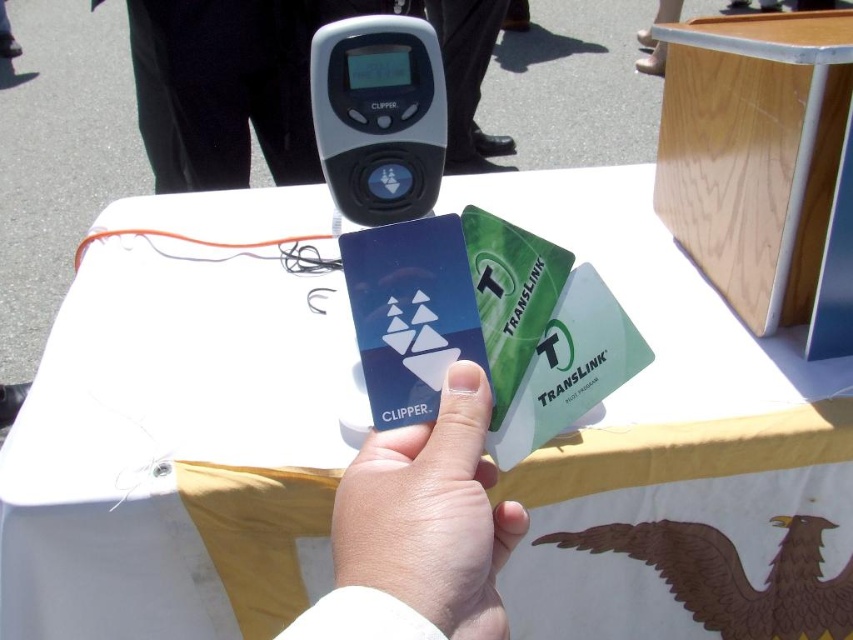
Question: Which of the following is the closest to the observer?

Choices:
 (A) white plastic table at center
 (B) white matte hand at center
 (C) brown matte/eagle at lower right
 (D) black plastic device at upper center

Answer: (B)

Question: Does white plastic table at center appear on the right side of blue plastic card at center?

Choices:
 (A) no
 (B) yes

Answer: (B)

Question: Which is nearer to the white plastic table at center?

Choices:
 (A) brown matte/eagle at lower right
 (B) blue plastic card at center

Answer: (A)

Question: In this image, where is blue plastic card at center located relative to brown matte/eagle at lower right?

Choices:
 (A) above
 (B) below

Answer: (A)

Question: Which point is farther to the camera?

Choices:
 (A) blue plastic card at center
 (B) white matte hand at center
 (C) black plastic device at upper center

Answer: (C)

Question: Is white plastic table at center thinner than white matte hand at center?

Choices:
 (A) yes
 (B) no

Answer: (B)